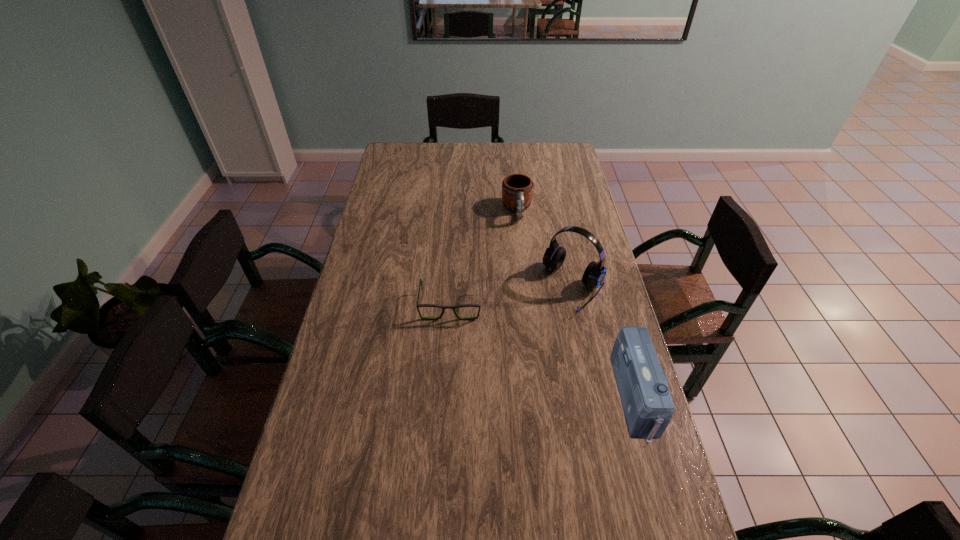
Locate an element on the screen. free space at the near left corner is located at coordinates (276, 530).

You are a GUI agent. You are given a task and a screenshot of the screen. Output one action in this format:
    pyautogui.click(x=<x>, y=<y>)
    Task: Click on the blank space at the far right corner
    The height and width of the screenshot is (540, 960).
    Given the screenshot: What is the action you would take?
    pyautogui.click(x=576, y=160)

Where is `vacant area between the leftmost object and the camera`? vacant area between the leftmost object and the camera is located at coordinates (543, 351).

At what (x,y) coordinates should I click in order to perform the action: click on free space between the mug and the third shortest object. Please return your answer as a coordinate pair (x, y). This screenshot has height=540, width=960. Looking at the image, I should click on (577, 304).

Locate an element on the screen. The height and width of the screenshot is (540, 960). empty space between the farthest object and the leftmost object is located at coordinates (484, 258).

Where is `free space between the nearest object and the second shortest object`? Image resolution: width=960 pixels, height=540 pixels. free space between the nearest object and the second shortest object is located at coordinates (577, 304).

Where is `free space between the mug and the third shortest object`? This screenshot has width=960, height=540. free space between the mug and the third shortest object is located at coordinates (577, 304).

Identify the location of free space between the spectacles and the tallest object. The image size is (960, 540). (513, 296).

Locate an element on the screen. free area in between the nearest object and the shortest object is located at coordinates (543, 351).

Find the location of `vacant area that lies between the headset and the farthest object`. vacant area that lies between the headset and the farthest object is located at coordinates (545, 248).